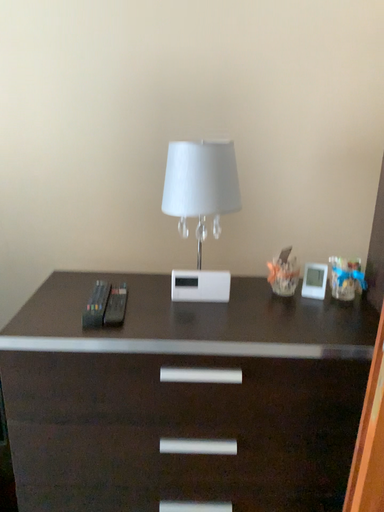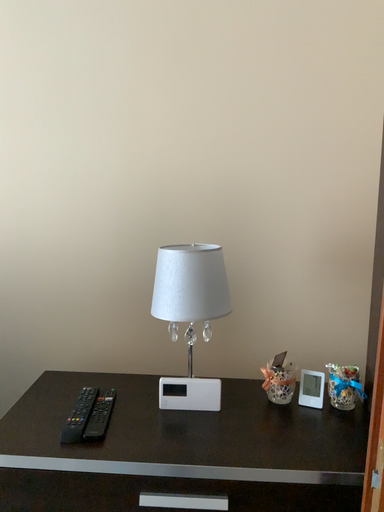
Question: How did the camera likely rotate when shooting the video?

Choices:
 (A) rotated downward
 (B) rotated upward

Answer: (B)